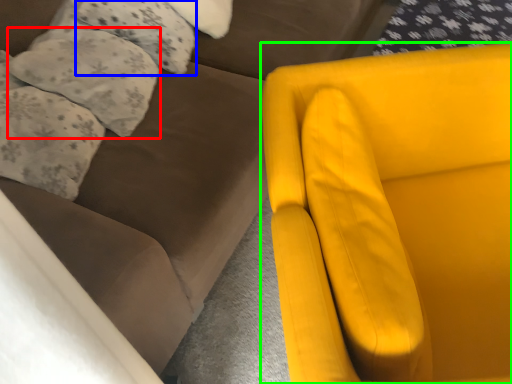
Question: Which is nearer to the pillow (highlighted by a red box)? pillow (highlighted by a blue box) or chair (highlighted by a green box).

Choices:
 (A) pillow
 (B) chair

Answer: (A)